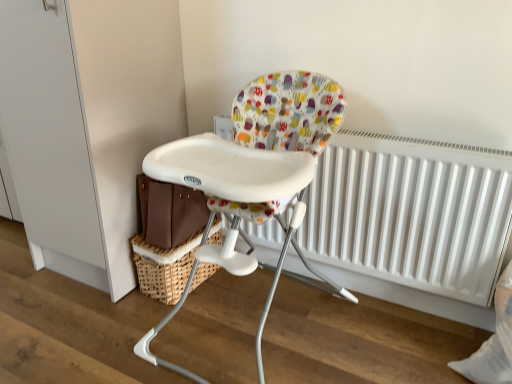
Describe the element at coordinates (252, 173) in the screenshot. I see `white plastic highchair at center` at that location.

Identify the location of white plastic highchair at center. The width and height of the screenshot is (512, 384). (252, 173).

Considering the relative positions of white matte radiator at center and white plastic highchair at center in the image provided, is white matte radiator at center to the left or to the right of white plastic highchair at center?

white matte radiator at center is to the right of white plastic highchair at center.

Is white matte radiator at center oriented towards white plastic highchair at center?

Yes, white matte radiator at center is turned towards white plastic highchair at center.

The height and width of the screenshot is (384, 512). I want to click on radiator lying on the right of white plastic highchair at center, so click(x=411, y=212).

From a real-world perspective, is white matte radiator at center located higher than white plastic highchair at center?

Incorrect, from a real-world perspective, white matte radiator at center is lower than white plastic highchair at center.

Who is bigger, white plastic highchair at center or white matte radiator at center?

With larger size is white plastic highchair at center.

Is white plastic highchair at center not near white matte radiator at center?

white plastic highchair at center is near white matte radiator at center, not far away.

Is white plastic highchair at center inside or outside of white matte radiator at center?

white plastic highchair at center lies outside white matte radiator at center.

Does white plastic highchair at center appear on the right side of white matte radiator at center?

No.

Who is bigger, woven brown basket at lower left or white plastic highchair at center?

With larger size is white plastic highchair at center.

Is woven brown basket at lower left spatially inside white plastic highchair at center, or outside of it?

The correct answer is: outside.

From a real-world perspective, is woven brown basket at lower left under white plastic highchair at center?

Yes, from a real-world perspective, woven brown basket at lower left is under white plastic highchair at center.

Where is `chair above the woven brown basket at lower left (from the image's perspective)`? chair above the woven brown basket at lower left (from the image's perspective) is located at coordinates (252, 173).

Can we say woven brown basket at lower left lies outside white matte radiator at center?

Yes, woven brown basket at lower left is located beyond the bounds of white matte radiator at center.

Who is taller, woven brown basket at lower left or white matte radiator at center?

Standing taller between the two is white matte radiator at center.

Does woven brown basket at lower left appear on the left side of white matte radiator at center?

Yes, woven brown basket at lower left is to the left of white matte radiator at center.

Which point is more forward, (138, 262) or (488, 155)?

The point (488, 155) is closer.

Is woven brown basket at lower left surrounded by white matte radiator at center?

No, woven brown basket at lower left is not inside white matte radiator at center.

From the image's perspective, is white matte radiator at center positioned above or below woven brown basket at lower left?

white matte radiator at center is situated higher than woven brown basket at lower left in the image.

Considering the relative positions of white matte radiator at center and woven brown basket at lower left in the image provided, is white matte radiator at center behind woven brown basket at lower left?

No, white matte radiator at center is closer to the camera.

Consider the image. How different are the orientations of white plastic highchair at center and woven brown basket at lower left in degrees?

8.67e-05 degrees separate the facing orientations of white plastic highchair at center and woven brown basket at lower left.

Is white plastic highchair at center facing towards woven brown basket at lower left?

No, white plastic highchair at center is not facing towards woven brown basket at lower left.

From a real-world perspective, does white plastic highchair at center sit lower than woven brown basket at lower left?

No, from a real-world perspective, white plastic highchair at center is not below woven brown basket at lower left.

From the image's perspective, between white plastic highchair at center and woven brown basket at lower left, which one is located above?

white plastic highchair at center, from the image's perspective.

This screenshot has height=384, width=512. I want to click on radiator that appears on the right of white plastic highchair at center, so click(x=411, y=212).

At what (x,y) coordinates should I click in order to perform the action: click on chair in front of the white matte radiator at center. Please return your answer as a coordinate pair (x, y). The width and height of the screenshot is (512, 384). Looking at the image, I should click on (252, 173).

Looking at the image, which one is located closer to white matte radiator at center, woven brown basket at lower left or white plastic highchair at center?

white plastic highchair at center lies closer to white matte radiator at center than the other object.

Considering their positions, is woven brown basket at lower left positioned closer to white plastic highchair at center than white matte radiator at center?

woven brown basket at lower left is positioned closer to the anchor white plastic highchair at center.

Which object lies nearer to the anchor point white matte radiator at center, white plastic highchair at center or woven brown basket at lower left?

white plastic highchair at center lies closer to white matte radiator at center than the other object.

Looking at the image, which one is located further to woven brown basket at lower left, white matte radiator at center or white plastic highchair at center?

Based on the image, white matte radiator at center appears to be further to woven brown basket at lower left.

Based on their spatial positions, is white plastic highchair at center or white matte radiator at center further from woven brown basket at lower left?

white matte radiator at center lies further to woven brown basket at lower left than the other object.

Looking at the image, which one is located further to white plastic highchair at center, white matte radiator at center or woven brown basket at lower left?

white matte radiator at center.

You are a GUI agent. You are given a task and a screenshot of the screen. Output one action in this format:
    pyautogui.click(x=<x>, y=<y>)
    Task: Click on the chair between woven brown basket at lower left and white matte radiator at center
    
    Given the screenshot: What is the action you would take?
    pyautogui.click(x=252, y=173)